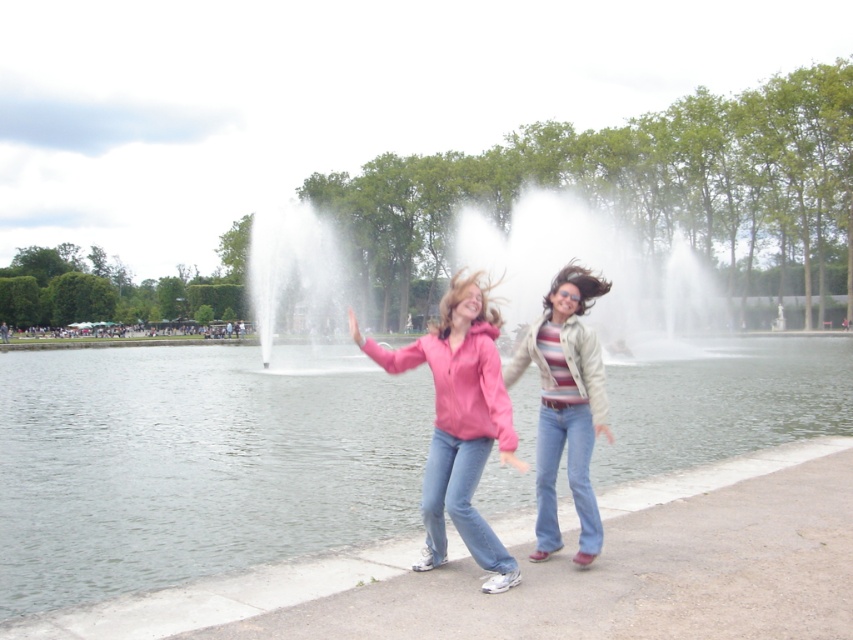
Question: Can you confirm if clear water at center is positioned below white water at center?

Choices:
 (A) yes
 (B) no

Answer: (A)

Question: Which object is positioned farthest from the white water at center?

Choices:
 (A) pink matte jacket at center
 (B) striped knit sweater at center
 (C) clear water at center

Answer: (A)

Question: Which object is the farthest from the white water at center?

Choices:
 (A) pink matte jacket at center
 (B) clear water at center
 (C) striped knit sweater at center

Answer: (A)

Question: Is white water at center above pink matte jacket at center?

Choices:
 (A) yes
 (B) no

Answer: (A)

Question: Which of the following is the farthest from the observer?

Choices:
 (A) white water at center
 (B) pink matte jacket at center
 (C) clear water at center
 (D) striped knit sweater at center

Answer: (C)

Question: Is white water at center smaller than pink matte jacket at center?

Choices:
 (A) no
 (B) yes

Answer: (A)